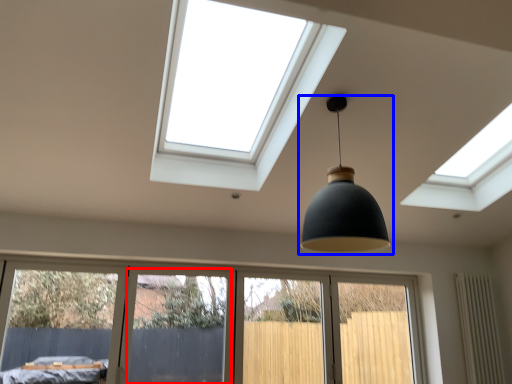
Question: Which object is closer to the camera taking this photo, screen door (highlighted by a red box) or lamp (highlighted by a blue box)?

Choices:
 (A) screen door
 (B) lamp

Answer: (B)